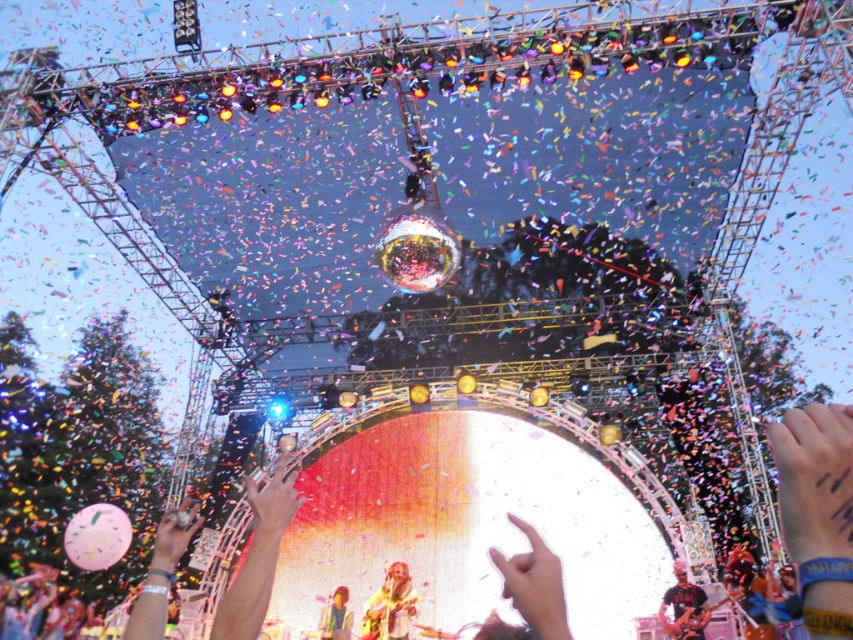
Question: Which point is farther to the camera?

Choices:
 (A) smooth skin person at center
 (B) beige fabric guitar at center

Answer: (B)

Question: Does yellow fabric hand at center have a larger size compared to matte black hand at center?

Choices:
 (A) no
 (B) yes

Answer: (B)

Question: Can you confirm if beige fabric guitar at center is smaller than matte silver ring at lower left?

Choices:
 (A) no
 (B) yes

Answer: (B)

Question: Can you confirm if yellow fabric hand at center is smaller than beige fabric guitar at center?

Choices:
 (A) no
 (B) yes

Answer: (A)

Question: Among these points, which one is farthest from the camera?

Choices:
 (A) (685, 576)
 (B) (146, 616)
 (C) (329, 637)

Answer: (C)

Question: Which object is the farthest from the yellow fabric hand at center?

Choices:
 (A) matte silver ring at lower left
 (B) beige fabric guitar at center

Answer: (A)